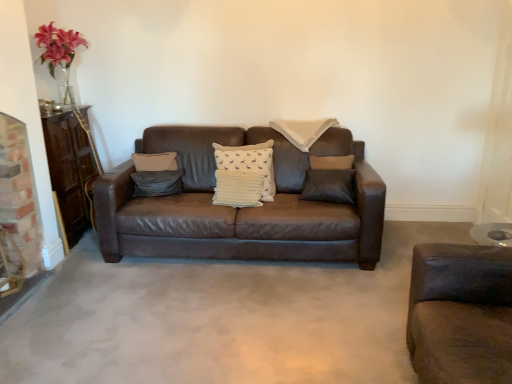
Question: Considering the relative positions of suede gray pillow at center, which is counted as the 2th pillow, starting from the right, and gray concrete at center in the image provided, is suede gray pillow at center, which is counted as the 2th pillow, starting from the right, to the right of gray concrete at center from the viewer's perspective?

Choices:
 (A) yes
 (B) no

Answer: (B)

Question: Can you confirm if suede gray pillow at center, the 1th pillow positioned from the left, is thinner than gray concrete at center?

Choices:
 (A) yes
 (B) no

Answer: (A)

Question: Does suede gray pillow at center, the 1th pillow positioned from the left, have a greater height compared to gray concrete at center?

Choices:
 (A) no
 (B) yes

Answer: (B)

Question: Does suede gray pillow at center, the 1th pillow positioned from the left, have a greater width compared to gray concrete at center?

Choices:
 (A) yes
 (B) no

Answer: (B)

Question: Is suede gray pillow at center, which is counted as the 2th pillow, starting from the right, facing towards gray concrete at center?

Choices:
 (A) no
 (B) yes

Answer: (A)

Question: Considering the positions of suede gray pillow at center, which is counted as the 2th pillow, starting from the right, and gray concrete at center in the image, is suede gray pillow at center, which is counted as the 2th pillow, starting from the right, taller or shorter than gray concrete at center?

Choices:
 (A) short
 (B) tall

Answer: (B)

Question: Is suede gray pillow at center, which is counted as the 2th pillow, starting from the right, wider or thinner than gray concrete at center?

Choices:
 (A) wide
 (B) thin

Answer: (B)

Question: Relative to gray concrete at center, is suede gray pillow at center, the 1th pillow positioned from the left, in front or behind?

Choices:
 (A) front
 (B) behind

Answer: (B)

Question: Is suede gray pillow at center, which is counted as the 2th pillow, starting from the right, bigger or smaller than gray concrete at center?

Choices:
 (A) small
 (B) big

Answer: (A)

Question: Is point (218, 160) closer or farther from the camera than point (151, 183)?

Choices:
 (A) closer
 (B) farther

Answer: (A)

Question: Is white dotted fabric pillow at center, marked as the 1th pillow in a right-to-left arrangement, in front of or behind suede gray pillow at center, the 1th pillow positioned from the left, in the image?

Choices:
 (A) behind
 (B) front

Answer: (B)

Question: Considering the positions of white dotted fabric pillow at center, marked as the 1th pillow in a right-to-left arrangement, and suede gray pillow at center, which is counted as the 2th pillow, starting from the right, in the image, is white dotted fabric pillow at center, marked as the 1th pillow in a right-to-left arrangement, wider or thinner than suede gray pillow at center, which is counted as the 2th pillow, starting from the right,?

Choices:
 (A) thin
 (B) wide

Answer: (B)

Question: Considering the relative positions of white dotted fabric pillow at center, the 2th pillow when ordered from left to right, and suede gray pillow at center, which is counted as the 2th pillow, starting from the right, in the image provided, is white dotted fabric pillow at center, the 2th pillow when ordered from left to right, to the left or to the right of suede gray pillow at center, which is counted as the 2th pillow, starting from the right,?

Choices:
 (A) right
 (B) left

Answer: (A)

Question: Choose the correct answer: Is white dotted fabric pillow at center, marked as the 1th pillow in a right-to-left arrangement, inside gray concrete at center or outside it?

Choices:
 (A) inside
 (B) outside

Answer: (B)

Question: From a real-world perspective, is white dotted fabric pillow at center, marked as the 1th pillow in a right-to-left arrangement, physically located above or below gray concrete at center?

Choices:
 (A) below
 (B) above

Answer: (B)